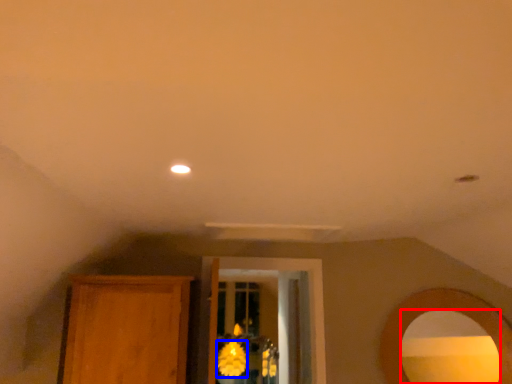
Question: Among these objects, which one is farthest to the camera, mirror (highlighted by a red box) or flower (highlighted by a blue box)?

Choices:
 (A) mirror
 (B) flower

Answer: (B)